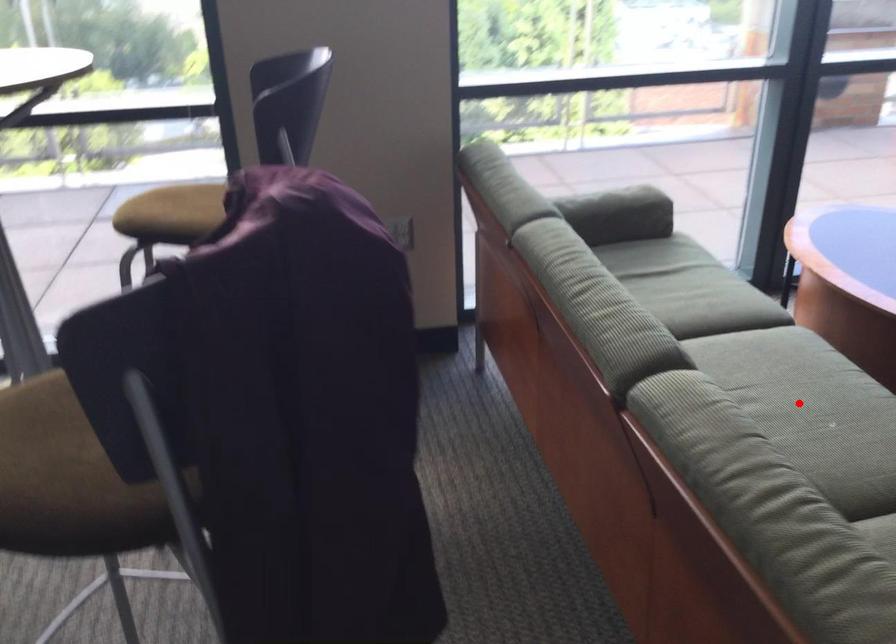
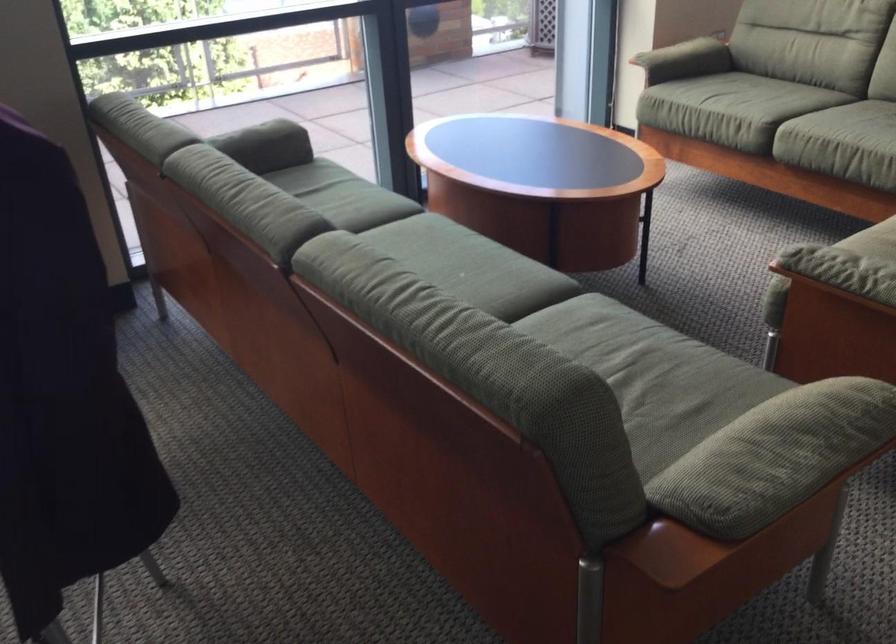
Question: I am providing you with two images of the same scene from different viewpoints. A red point is marked on the first image. Is the red point's position out of view in image 2?

Choices:
 (A) Yes
 (B) No

Answer: (B)